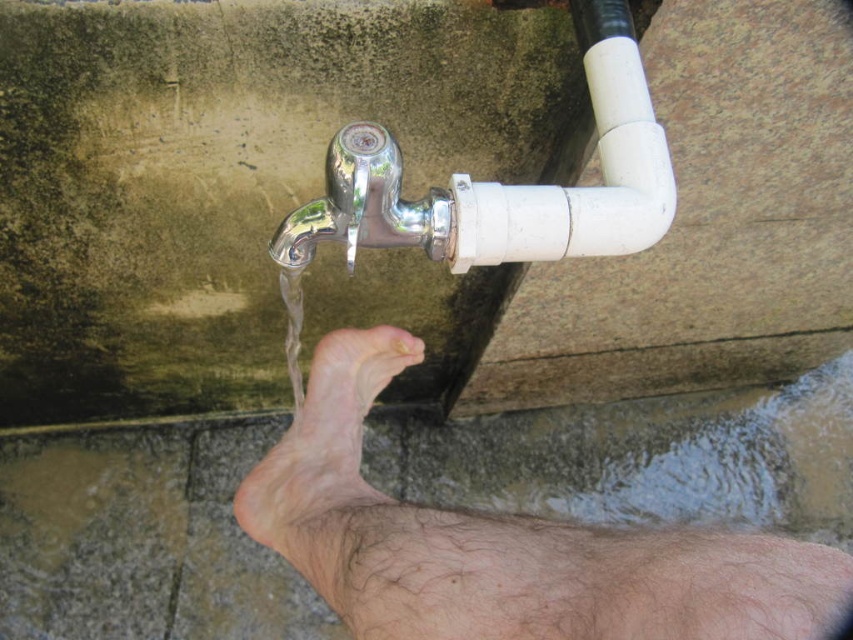
Is chrome/polished metal water pipe at upper center wider than pale skin foot at lower center?

Yes, chrome/polished metal water pipe at upper center is wider than pale skin foot at lower center.

Does chrome/polished metal water pipe at upper center come in front of pale skin foot at lower center?

No, chrome/polished metal water pipe at upper center is further to the viewer.

Find the location of a particular element. chrome/polished metal water pipe at upper center is located at coordinates (506, 184).

Is hair-covered skin foot at lower center positioned before chrome/polished metal water pipe at upper center?

Yes, it is in front of chrome/polished metal water pipe at upper center.

Is hair-covered skin foot at lower center below chrome/polished metal water pipe at upper center?

Correct, hair-covered skin foot at lower center is located below chrome/polished metal water pipe at upper center.

This screenshot has width=853, height=640. What do you see at coordinates (505, 545) in the screenshot?
I see `hair-covered skin foot at lower center` at bounding box center [505, 545].

The width and height of the screenshot is (853, 640). Find the location of `hair-covered skin foot at lower center`. hair-covered skin foot at lower center is located at coordinates (505, 545).

Can you confirm if hair-covered skin foot at lower center is thinner than pale skin foot at lower center?

Incorrect, hair-covered skin foot at lower center's width is not less than pale skin foot at lower center's.

Between hair-covered skin foot at lower center and pale skin foot at lower center, which one appears on the right side from the viewer's perspective?

From the viewer's perspective, hair-covered skin foot at lower center appears more on the right side.

Does point (245, 509) lie behind point (297, 532)?

Yes, point (245, 509) is farther from viewer.

The height and width of the screenshot is (640, 853). I want to click on hair-covered skin foot at lower center, so click(505, 545).